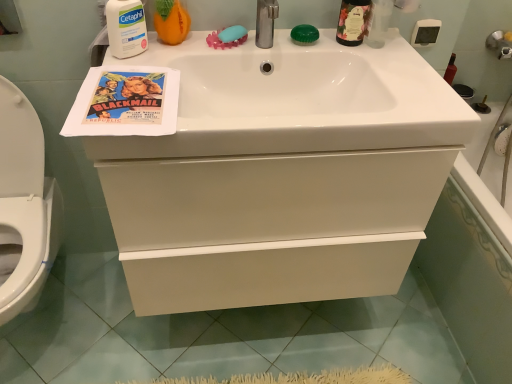
Image resolution: width=512 pixels, height=384 pixels. Find the location of `free space in front of white matte cetaphil at upper left, which appears as the second cleaning product when viewed from the right`. free space in front of white matte cetaphil at upper left, which appears as the second cleaning product when viewed from the right is located at coordinates (131, 81).